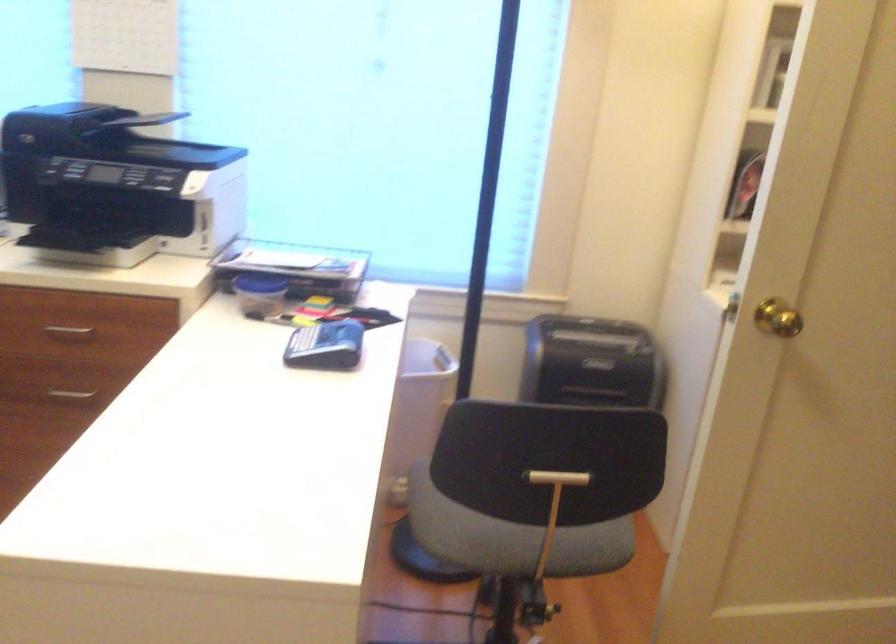
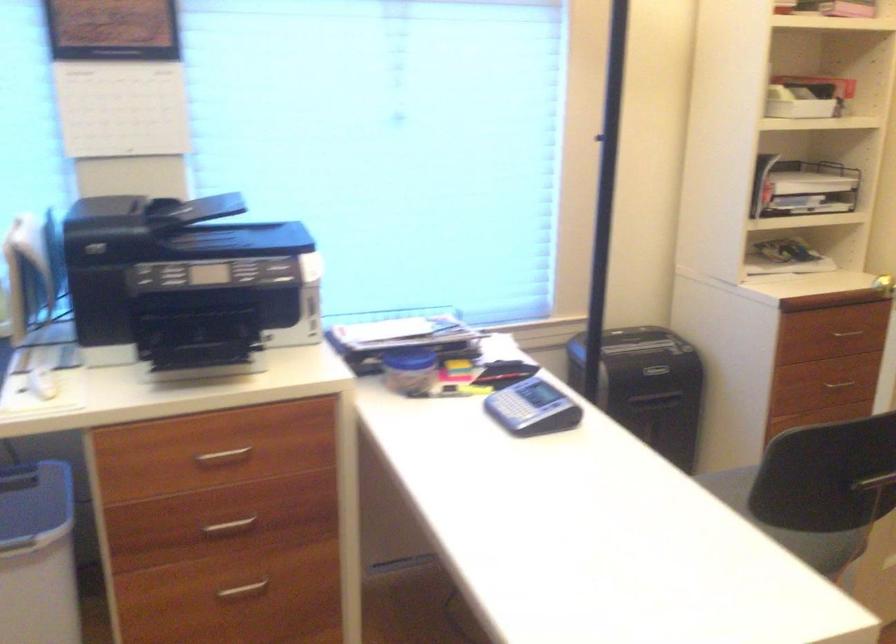
Locate, in the second image, the point that corresponds to point 71,330 in the first image.

(222, 457)